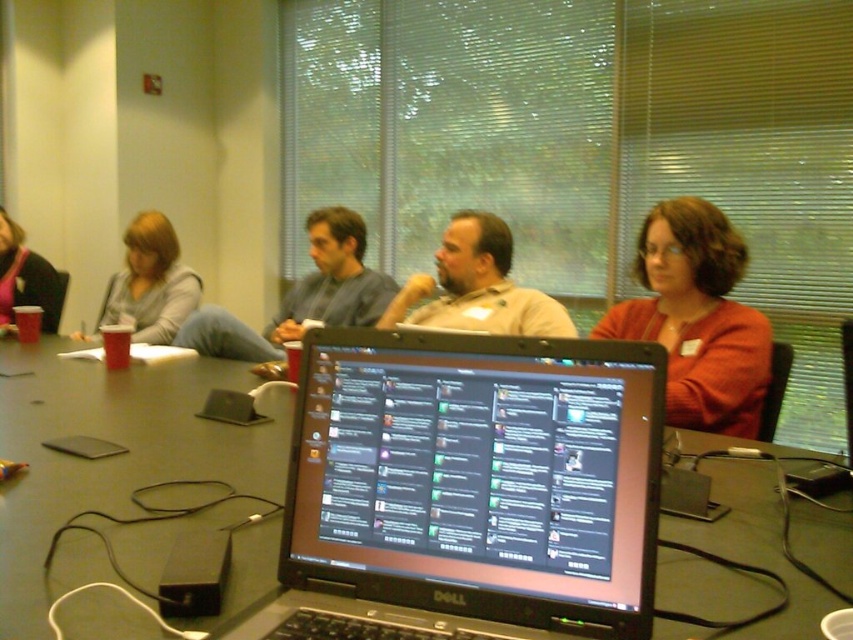
Does black plastic table at center have a greater width compared to matte black laptop at left?

Correct, the width of black plastic table at center exceeds that of matte black laptop at left.

Looking at this image, is black plastic table at center positioned at the back of matte black laptop at left?

No.

Find the location of a particular element. black plastic table at center is located at coordinates (109, 460).

Find the location of a particular element. This screenshot has width=853, height=640. black plastic table at center is located at coordinates (109, 460).

Can you confirm if matte orange sweater at center is bigger than matte gray sweater at upper left?

No, matte orange sweater at center is not bigger than matte gray sweater at upper left.

Which is behind, point (703, 250) or point (96, 326)?

The point (96, 326) is behind.

Between point (654, 256) and point (155, 244), which one is positioned behind?

The point (155, 244) is behind.

Find the location of a particular element. The width and height of the screenshot is (853, 640). matte orange sweater at center is located at coordinates (697, 317).

Based on the photo, who is lower down, black glossy laptop at center or matte blue shirt at center?

black glossy laptop at center is below.

At what (x,y) coordinates should I click in order to perform the action: click on black glossy laptop at center. Please return your answer as a coordinate pair (x, y). Looking at the image, I should click on (477, 476).